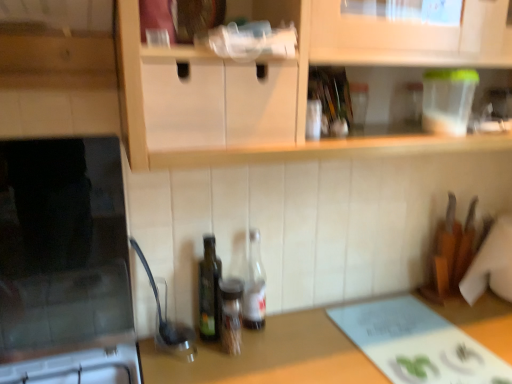
The width and height of the screenshot is (512, 384). In order to click on spots to the right of translucent glass bottle at center, which appears as the 3th bottle when viewed from the left in this screenshot , I will do `click(298, 333)`.